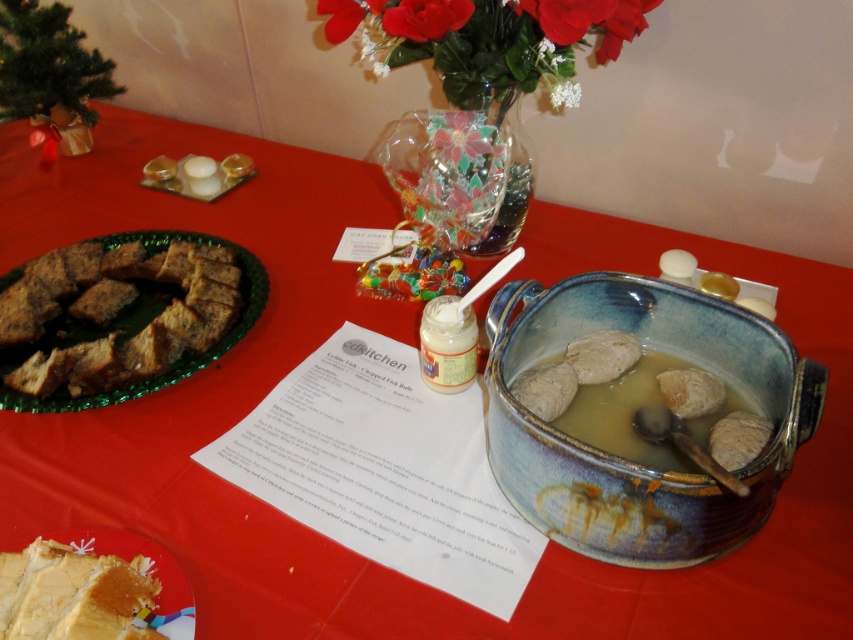
You are a guest at the festive table and want to place your napkin on the table. If you want to place it to the right of the red silk flowers at upper center, will it be to the left or right of the blue glazed pot at center?

The red silk flowers at upper center are to the left of the blue glazed pot at center. Placing the napkin to the right of the red silk flowers at upper center would position it to the left of the blue glazed pot at center.